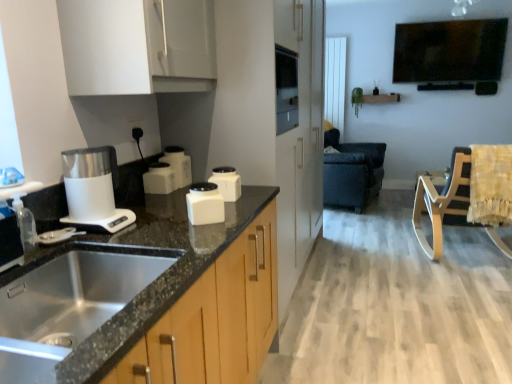
Question: Can you confirm if dark leather rocking chair at center, the 1th rocking chair positioned from the back, is thinner than clear plastic spray bottle at left?

Choices:
 (A) no
 (B) yes

Answer: (A)

Question: Is dark leather rocking chair at center, the 1th rocking chair positioned from the back, to the right of clear plastic spray bottle at left from the viewer's perspective?

Choices:
 (A) yes
 (B) no

Answer: (A)

Question: From a real-world perspective, is dark leather rocking chair at center, the second rocking chair positioned from the front, below clear plastic spray bottle at left?

Choices:
 (A) no
 (B) yes

Answer: (B)

Question: From the image's perspective, is dark leather rocking chair at center, the second rocking chair positioned from the front, over clear plastic spray bottle at left?

Choices:
 (A) no
 (B) yes

Answer: (B)

Question: Does dark leather rocking chair at center, the 1th rocking chair positioned from the back, have a smaller size compared to clear plastic spray bottle at left?

Choices:
 (A) no
 (B) yes

Answer: (A)

Question: From a real-world perspective, is white glossy container at center, positioned as the 4th kitchen appliance in front-to-back order, physically located above or below yellow fabric swivel chair at right?

Choices:
 (A) below
 (B) above

Answer: (B)

Question: Is point (190, 172) closer or farther from the camera than point (508, 190)?

Choices:
 (A) closer
 (B) farther

Answer: (A)

Question: Looking at the image, does white glossy container at center, placed as the 1th kitchen appliance when sorted from back to front, seem bigger or smaller compared to yellow fabric swivel chair at right?

Choices:
 (A) big
 (B) small

Answer: (B)

Question: From the image's perspective, is white glossy container at center, placed as the 1th kitchen appliance when sorted from back to front, above or below yellow fabric swivel chair at right?

Choices:
 (A) below
 (B) above

Answer: (B)

Question: Considering their positions, is yellow fabric swivel chair at right located in front of or behind black glossy tv at upper right?

Choices:
 (A) behind
 (B) front

Answer: (B)

Question: From the image's perspective, is yellow fabric swivel chair at right above or below black glossy tv at upper right?

Choices:
 (A) above
 (B) below

Answer: (B)

Question: From a real-world perspective, relative to black glossy tv at upper right, is yellow fabric swivel chair at right vertically above or below?

Choices:
 (A) below
 (B) above

Answer: (A)

Question: Would you say yellow fabric swivel chair at right is inside or outside black glossy tv at upper right?

Choices:
 (A) outside
 (B) inside

Answer: (A)

Question: From the image's perspective, is white glossy container at center, marked as the 2th kitchen appliance in a back-to-front arrangement, located above or below wooden rocking chair at right, the 2th rocking chair when ordered from back to front?

Choices:
 (A) below
 (B) above

Answer: (B)

Question: Which is correct: white glossy container at center, marked as the 2th kitchen appliance in a back-to-front arrangement, is inside wooden rocking chair at right, the 2th rocking chair when ordered from back to front, or outside of it?

Choices:
 (A) outside
 (B) inside

Answer: (A)